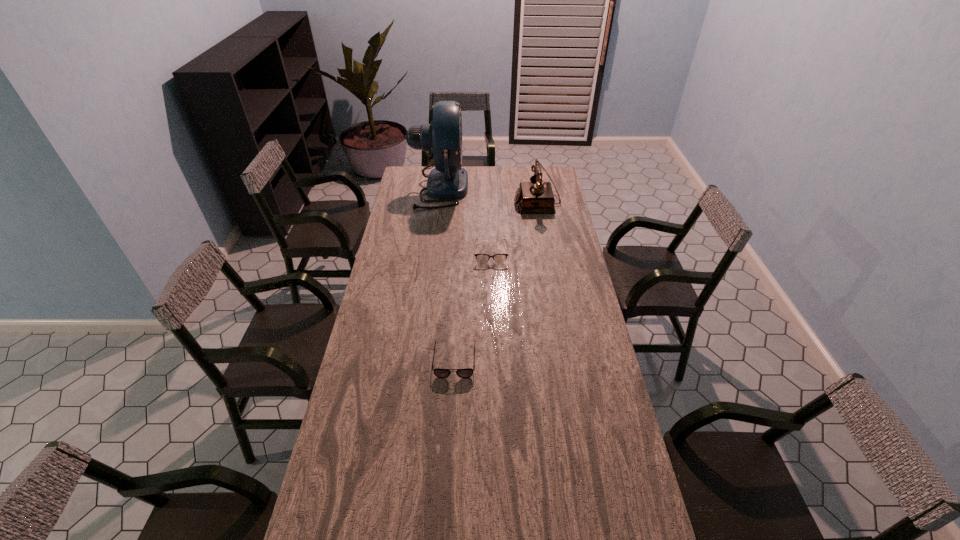
Where is `free point located 0.230m on the temples of the leftmost spectacles`? free point located 0.230m on the temples of the leftmost spectacles is located at coordinates (472, 269).

You are a GUI agent. You are given a task and a screenshot of the screen. Output one action in this format:
    pyautogui.click(x=<x>, y=<y>)
    Task: Click on the object that is positioned at the far edge
    The height and width of the screenshot is (540, 960).
    Given the screenshot: What is the action you would take?
    pyautogui.click(x=442, y=138)

What are the coordinates of `fan located at the left edge` in the screenshot? It's located at (442, 138).

Where is `spectacles positioned at the left edge`? spectacles positioned at the left edge is located at coordinates (398, 255).

Identify the location of object at the right edge. Image resolution: width=960 pixels, height=540 pixels. (535, 197).

You are a GUI agent. You are given a task and a screenshot of the screen. Output one action in this format:
    pyautogui.click(x=<x>, y=<y>)
    Task: Click on the object that is at the far left corner
    This screenshot has width=960, height=540.
    Given the screenshot: What is the action you would take?
    pyautogui.click(x=442, y=138)

In the image, there is a desktop. Where is `vacant space at the far edge`? The width and height of the screenshot is (960, 540). vacant space at the far edge is located at coordinates (514, 169).

This screenshot has width=960, height=540. Identify the location of blank space at the left edge of the desktop. (416, 251).

This screenshot has width=960, height=540. I want to click on free spot at the right edge of the desktop, so click(579, 264).

The height and width of the screenshot is (540, 960). What are the coordinates of `vacant space at the far right corner of the desktop` in the screenshot? It's located at (555, 184).